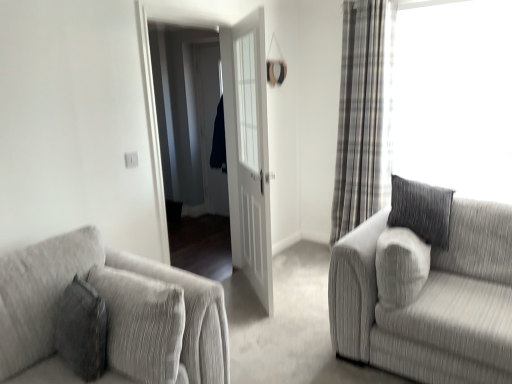
Question: Is plaid fabric curtain at right at the right side of textured gray couch at right, the 1th studio couch viewed from the right?

Choices:
 (A) yes
 (B) no

Answer: (B)

Question: Does plaid fabric curtain at right have a larger size compared to textured gray couch at right, placed as the 2th studio couch when sorted from left to right?

Choices:
 (A) no
 (B) yes

Answer: (A)

Question: Can you confirm if plaid fabric curtain at right is smaller than textured gray couch at right, placed as the 2th studio couch when sorted from left to right?

Choices:
 (A) no
 (B) yes

Answer: (B)

Question: From the image's perspective, does plaid fabric curtain at right appear lower than textured gray couch at right, the 1th studio couch viewed from the right?

Choices:
 (A) yes
 (B) no

Answer: (B)

Question: Is plaid fabric curtain at right next to textured gray couch at right, placed as the 2th studio couch when sorted from left to right?

Choices:
 (A) yes
 (B) no

Answer: (B)

Question: Looking at the image, does textured gray couch at right, the 1th studio couch viewed from the right, seem bigger or smaller compared to plaid fabric curtain at right?

Choices:
 (A) small
 (B) big

Answer: (B)

Question: Looking at their shapes, would you say textured gray couch at right, the 1th studio couch viewed from the right, is wider or thinner than plaid fabric curtain at right?

Choices:
 (A) thin
 (B) wide

Answer: (B)

Question: Would you say textured gray couch at right, placed as the 2th studio couch when sorted from left to right, is to the left or to the right of plaid fabric curtain at right in the picture?

Choices:
 (A) right
 (B) left

Answer: (A)

Question: Is textured gray couch at right, the 1th studio couch viewed from the right, inside the boundaries of plaid fabric curtain at right, or outside?

Choices:
 (A) outside
 (B) inside

Answer: (A)

Question: From a real-world perspective, is textured gray couch at lower left, which ranks as the first studio couch in left-to-right order, above or below plaid fabric curtain at right?

Choices:
 (A) below
 (B) above

Answer: (A)

Question: Is point (5, 266) positioned closer to the camera than point (381, 44)?

Choices:
 (A) farther
 (B) closer

Answer: (B)

Question: Is textured gray couch at lower left, which ranks as the first studio couch in left-to-right order, wider or thinner than plaid fabric curtain at right?

Choices:
 (A) thin
 (B) wide

Answer: (B)

Question: Is textured gray couch at lower left, the 2th studio couch in the right-to-left sequence, situated inside plaid fabric curtain at right or outside?

Choices:
 (A) outside
 (B) inside

Answer: (A)

Question: From the image's perspective, is textured gray couch at right, the 1th studio couch viewed from the right, located above or below textured gray couch at lower left, the 2th studio couch in the right-to-left sequence?

Choices:
 (A) above
 (B) below

Answer: (A)

Question: In terms of width, does textured gray couch at right, placed as the 2th studio couch when sorted from left to right, look wider or thinner when compared to textured gray couch at lower left, which ranks as the first studio couch in left-to-right order?

Choices:
 (A) thin
 (B) wide

Answer: (B)